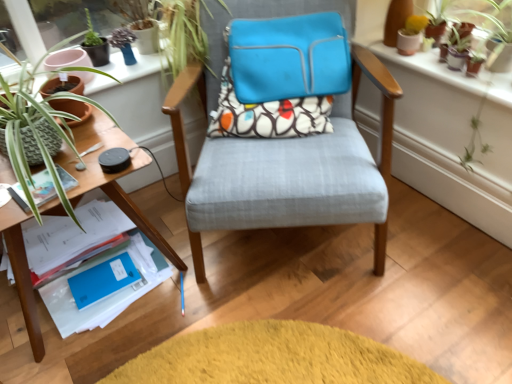
I want to click on free point to the right of wooden table at left, so click(x=203, y=296).